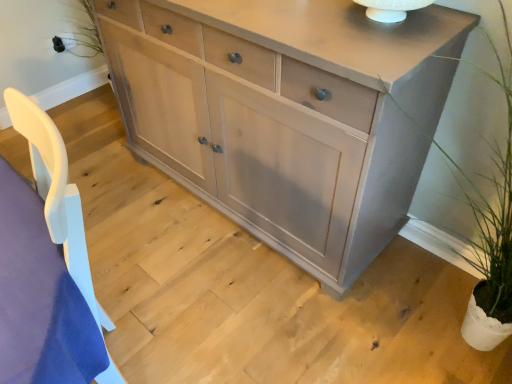
Describe the element at coordinates (287, 115) in the screenshot. I see `matte gray cabinet at center` at that location.

Identify the location of matte gray cabinet at center. The image size is (512, 384). (287, 115).

You are a GUI agent. You are given a task and a screenshot of the screen. Output one action in this format:
    pyautogui.click(x=<x>, y=<y>)
    Task: Click on the green leafy plant at right
    This screenshot has width=512, height=384.
    Given the screenshot: What is the action you would take?
    pyautogui.click(x=494, y=208)

What do you see at coordinates (494, 208) in the screenshot? Image resolution: width=512 pixels, height=384 pixels. I see `green leafy plant at right` at bounding box center [494, 208].

The image size is (512, 384). I want to click on matte gray cabinet at center, so click(287, 115).

Which object is positioned more to the right, green leafy plant at right or matte gray cabinet at center?

green leafy plant at right is more to the right.

Which is in front, green leafy plant at right or matte gray cabinet at center?

green leafy plant at right.

In the scene shown: Which point is more distant from viewer, (499,80) or (144,140)?

The point (144,140) is more distant.

From the image's perspective, which is below, green leafy plant at right or matte gray cabinet at center?

green leafy plant at right, from the image's perspective.

In the scene shown: From a real-world perspective, is green leafy plant at right beneath matte gray cabinet at center?

No, from a real-world perspective, green leafy plant at right is not beneath matte gray cabinet at center.

Which object is wider, green leafy plant at right or matte gray cabinet at center?

green leafy plant at right is wider.

Is green leafy plant at right taller or shorter than matte gray cabinet at center?

green leafy plant at right is taller than matte gray cabinet at center.

Based on their sizes in the image, would you say green leafy plant at right is bigger or smaller than matte gray cabinet at center?

green leafy plant at right is smaller than matte gray cabinet at center.

Is green leafy plant at right spatially inside matte gray cabinet at center, or outside of it?

The correct answer is: outside.

Does green leafy plant at right touch matte gray cabinet at center?

No, green leafy plant at right is not making contact with matte gray cabinet at center.

Is green leafy plant at right positioned with its back to matte gray cabinet at center?

green leafy plant at right does not have its back to matte gray cabinet at center.

This screenshot has width=512, height=384. What are the coordinates of `chest of drawers behind the green leafy plant at right` in the screenshot? It's located at (287, 115).

Considering the positions of objects matte gray cabinet at center and green leafy plant at right in the image provided, who is more to the right, matte gray cabinet at center or green leafy plant at right?

From the viewer's perspective, green leafy plant at right appears more on the right side.

Who is more distant, matte gray cabinet at center or green leafy plant at right?

matte gray cabinet at center is more distant.

Which is behind, point (329, 118) or point (480, 226)?

The point (480, 226) is behind.

From the image's perspective, between matte gray cabinet at center and green leafy plant at right, who is located below?

From the image's view, green leafy plant at right is below.

From a real-world perspective, is matte gray cabinet at center physically below green leafy plant at right?

Yes, from a real-world perspective, matte gray cabinet at center is beneath green leafy plant at right.

Considering the relative sizes of matte gray cabinet at center and green leafy plant at right in the image provided, is matte gray cabinet at center thinner than green leafy plant at right?

Yes.

Is matte gray cabinet at center taller or shorter than green leafy plant at right?

In the image, matte gray cabinet at center appears to be shorter than green leafy plant at right.

Can you confirm if matte gray cabinet at center is bigger than green leafy plant at right?

Correct, matte gray cabinet at center is larger in size than green leafy plant at right.

Does matte gray cabinet at center contain green leafy plant at right?

That's incorrect, green leafy plant at right is not inside matte gray cabinet at center.

Is the surface of matte gray cabinet at center in direct contact with green leafy plant at right?

matte gray cabinet at center and green leafy plant at right are clearly separated.

Is matte gray cabinet at center facing towards green leafy plant at right?

No, matte gray cabinet at center is not aimed at green leafy plant at right.

Find the location of a particular element. This screenshot has height=384, width=512. plant in front of the matte gray cabinet at center is located at coordinates tap(494, 208).

Locate an element on the screen. The width and height of the screenshot is (512, 384). plant below the matte gray cabinet at center (from the image's perspective) is located at coordinates click(x=494, y=208).

You are a GUI agent. You are given a task and a screenshot of the screen. Output one action in this format:
    pyautogui.click(x=<x>, y=<y>)
    Task: Click on the plant on the right of matte gray cabinet at center
    The image size is (512, 384).
    Given the screenshot: What is the action you would take?
    pyautogui.click(x=494, y=208)